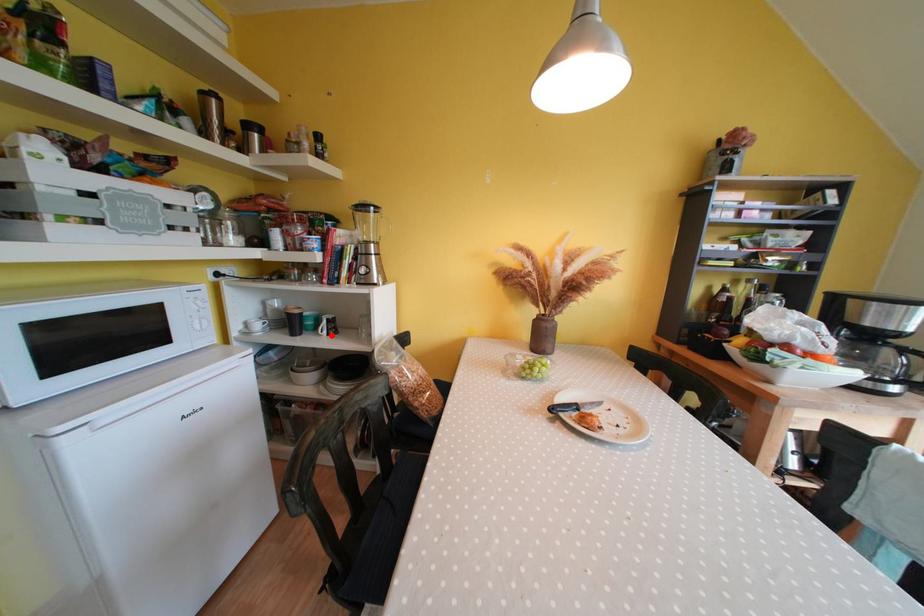
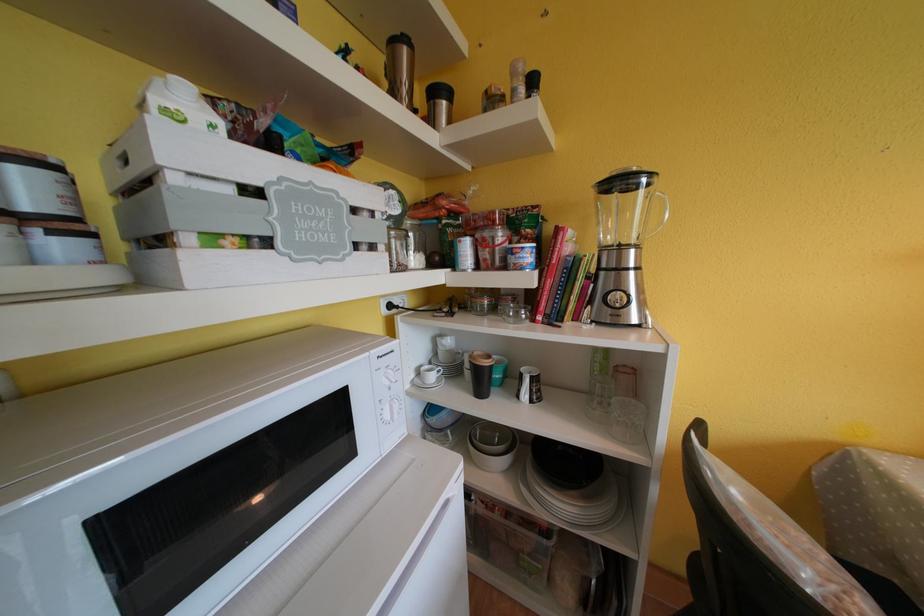
In the second image, find the point that corresponds to the highlighted location in the first image.

(533, 400)